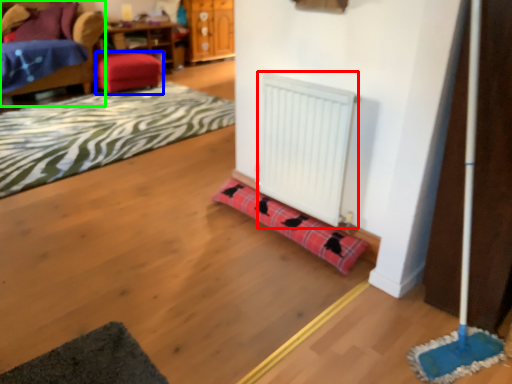
Question: Which object is the farthest from radiator (highlighted by a red box)? Choose among these: stool (highlighted by a blue box) or furniture (highlighted by a green box).

Choices:
 (A) stool
 (B) furniture

Answer: (B)